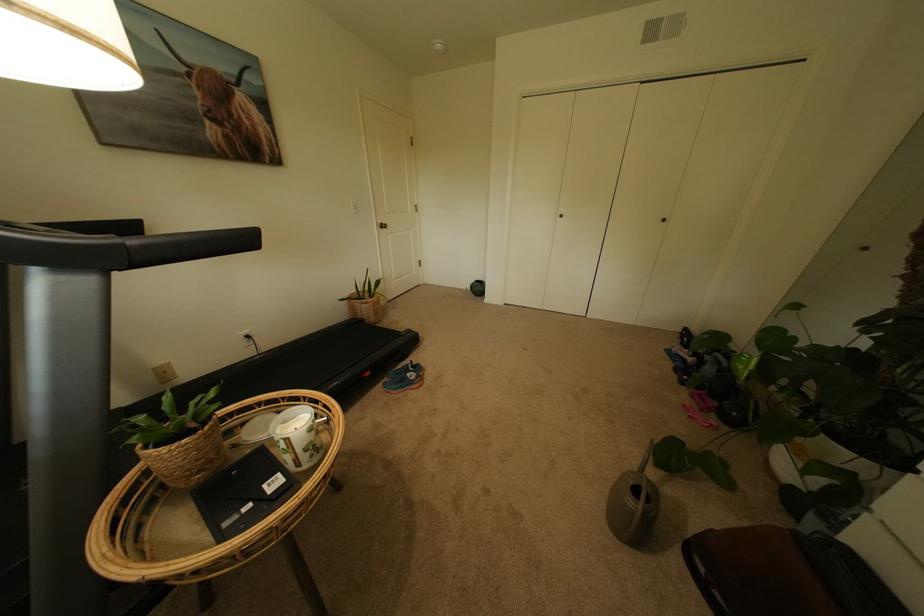
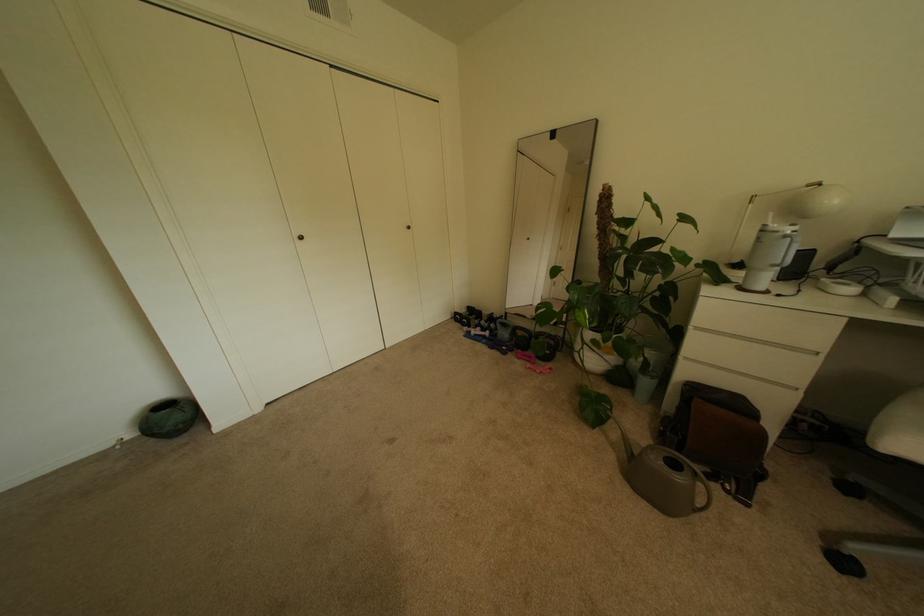
Where in the second image is the point corresponding to point (714, 392) from the first image?

(524, 350)